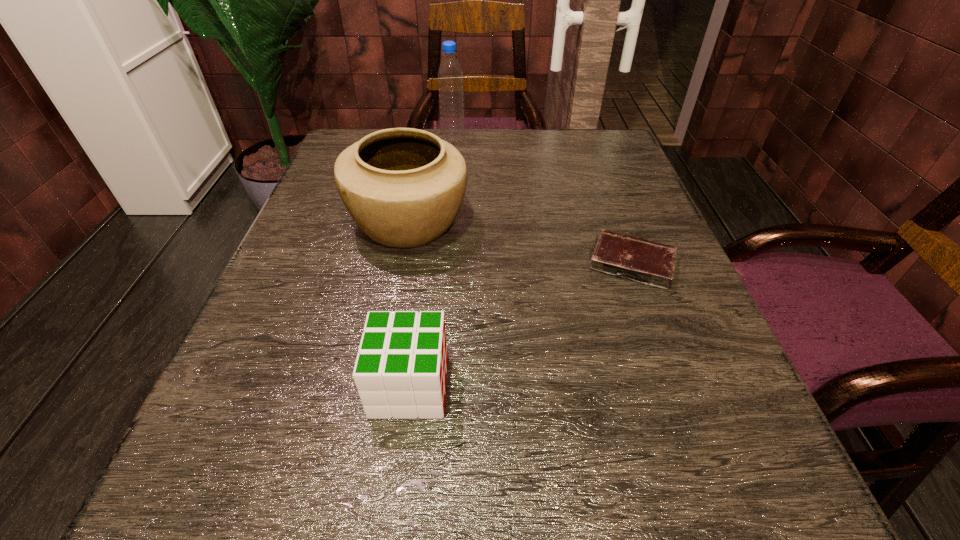
You are a GUI agent. You are given a task and a screenshot of the screen. Output one action in this format:
    pyautogui.click(x=<x>, y=<y>)
    Task: Click on the water bottle
    The image size is (960, 540).
    Given the screenshot: What is the action you would take?
    pyautogui.click(x=450, y=77)

You are a GUI agent. You are given a task and a screenshot of the screen. Output one action in this format:
    pyautogui.click(x=<x>, y=<y>)
    Task: Click on the tallest object
    The image size is (960, 540).
    Given the screenshot: What is the action you would take?
    pyautogui.click(x=450, y=77)

Locate an element on the screen. The image size is (960, 540). the third shortest object is located at coordinates (403, 187).

I want to click on cube, so click(x=400, y=371).

Identify the location of the third tallest object. This screenshot has height=540, width=960. (400, 371).

Image resolution: width=960 pixels, height=540 pixels. Find the location of `diary`. diary is located at coordinates (644, 261).

Locate an element on the screen. The height and width of the screenshot is (540, 960). the shortest object is located at coordinates (644, 261).

Locate an element on the screen. This screenshot has width=960, height=540. free space located on the right of the tallest object is located at coordinates tap(604, 140).

The width and height of the screenshot is (960, 540). What are the coordinates of `vacant space located 0.210m on the back of the pottery` in the screenshot? It's located at (424, 143).

The width and height of the screenshot is (960, 540). Identify the location of vacant position located 0.210m on the red face of the cube. (604, 386).